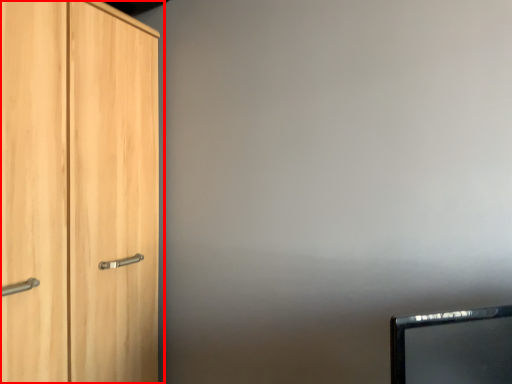
Question: Considering the relative positions of cupboard (annotated by the red box) and computer monitor in the image provided, where is cupboard (annotated by the red box) located with respect to the staircase?

Choices:
 (A) left
 (B) right

Answer: (A)